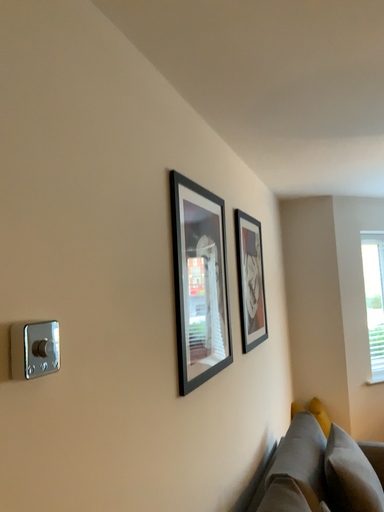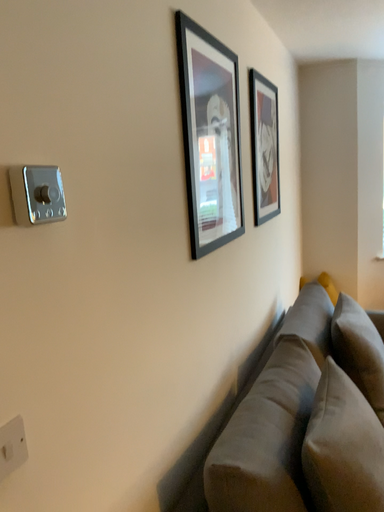
Question: How did the camera likely rotate when shooting the video?

Choices:
 (A) rotated downward
 (B) rotated upward

Answer: (A)